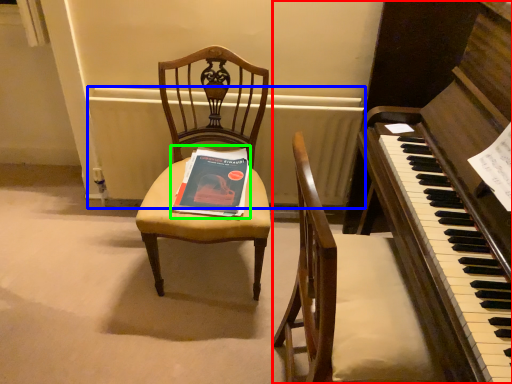
Question: Which object is the farthest from harpsichord (highlighted by a red box)? Choose among these: radiator (highlighted by a blue box) or paperback book (highlighted by a green box).

Choices:
 (A) radiator
 (B) paperback book

Answer: (A)